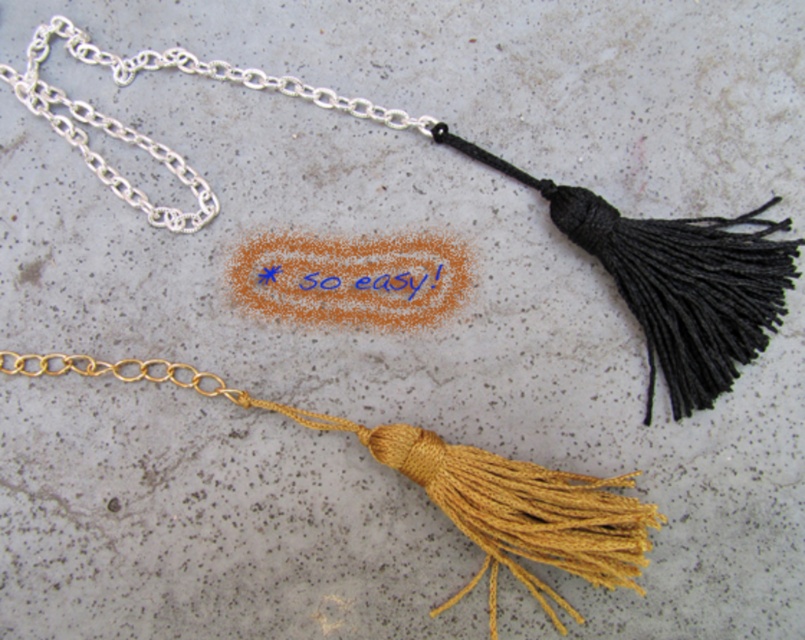
You are a jeweler who needs to locate the silver chain at upper left in the image. What are its coordinates?

The silver chain at upper left is located at coordinates point (149, 138).

You are standing in front of two points on a concrete surface. You see point at (572, 497) and point at (197, 214). Which point is closer to you?

Point at (572, 497) is in front of point at (197, 214), so it is closer to you.

You are an interior designer arranging items on a concrete surface. You need to place a decorative item exactly at point (x=453, y=488). Which object from the scene is already positioned there?

The satin gold tassel at lower center is located at point (x=453, y=488).